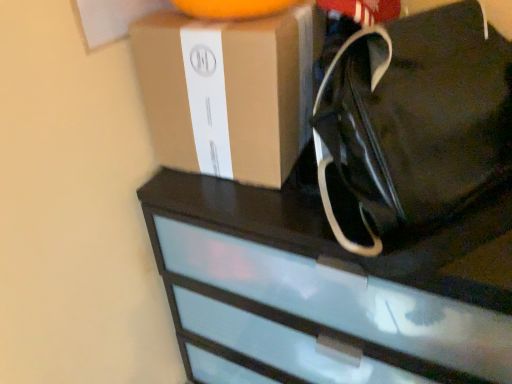
Describe the element at coordinates (229, 91) in the screenshot. I see `brown cardboard box at upper center` at that location.

Find the location of a particular element. This screenshot has height=384, width=512. brown cardboard box at upper center is located at coordinates (229, 91).

From a real-world perspective, is black glossy chest of drawers at upper center above or below brown cardboard box at upper center?

Clearly, from a real-world perspective, black glossy chest of drawers at upper center is below brown cardboard box at upper center.

Considering the positions of point (332, 333) and point (276, 29), is point (332, 333) closer or farther from the camera than point (276, 29)?

Point (332, 333) is positioned farther from the camera compared to point (276, 29).

Is black glossy chest of drawers at upper center not near brown cardboard box at upper center?

black glossy chest of drawers at upper center is actually quite close to brown cardboard box at upper center.

Who is more distant, black glossy chest of drawers at upper center or brown cardboard box at upper center?

brown cardboard box at upper center is further away from the camera.

Is black fabric tote at upper right positioned before black glossy chest of drawers at upper center?

Yes, black fabric tote at upper right is in front of black glossy chest of drawers at upper center.

From the image's perspective, is black fabric tote at upper right above black glossy chest of drawers at upper center?

Yes, from the image's perspective, black fabric tote at upper right is over black glossy chest of drawers at upper center.

Is black fabric tote at upper right positioned far away from black glossy chest of drawers at upper center?

black fabric tote at upper right is actually quite close to black glossy chest of drawers at upper center.

Identify the location of chest of drawers below the black fabric tote at upper right (from a real-world perspective). (323, 289).

Considering the relative positions of brown cardboard box at upper center and black glossy chest of drawers at upper center in the image provided, is brown cardboard box at upper center to the right of black glossy chest of drawers at upper center from the viewer's perspective?

No.

You are a GUI agent. You are given a task and a screenshot of the screen. Output one action in this format:
    pyautogui.click(x=<x>, y=<y>)
    Task: Click on the box behind the black glossy chest of drawers at upper center
    The width and height of the screenshot is (512, 384).
    Given the screenshot: What is the action you would take?
    pyautogui.click(x=229, y=91)

From a real-world perspective, between brown cardboard box at upper center and black glossy chest of drawers at upper center, who is vertically higher?

brown cardboard box at upper center, from a real-world perspective.

Can you tell me how much brown cardboard box at upper center and black glossy chest of drawers at upper center differ in facing direction?

The angle between the facing direction of brown cardboard box at upper center and the facing direction of black glossy chest of drawers at upper center is 0.442 degrees.

Is black fabric tote at upper right turned away from brown cardboard box at upper center?

Yes.

Does black fabric tote at upper right come behind brown cardboard box at upper center?

No, black fabric tote at upper right is closer to the camera.

From the image's perspective, is black fabric tote at upper right located beneath brown cardboard box at upper center?

Yes, from the image's perspective, black fabric tote at upper right is beneath brown cardboard box at upper center.

Is black fabric tote at upper right inside the boundaries of brown cardboard box at upper center, or outside?

black fabric tote at upper right is spatially situated outside brown cardboard box at upper center.

Is there a large distance between brown cardboard box at upper center and black fabric tote at upper right?

Actually, brown cardboard box at upper center and black fabric tote at upper right are a little close together.

Considering the sizes of objects brown cardboard box at upper center and black fabric tote at upper right in the image provided, who is smaller, brown cardboard box at upper center or black fabric tote at upper right?

With smaller size is brown cardboard box at upper center.

Measure the distance between brown cardboard box at upper center and black fabric tote at upper right.

The distance of brown cardboard box at upper center from black fabric tote at upper right is 7.57 inches.

Which object is positioned more to the right, brown cardboard box at upper center or black fabric tote at upper right?

From the viewer's perspective, black fabric tote at upper right appears more on the right side.

From the image's perspective, would you say black glossy chest of drawers at upper center is shown under black fabric tote at upper right?

Indeed, from the image's perspective, black glossy chest of drawers at upper center is shown beneath black fabric tote at upper right.

Locate an element on the screen. Image resolution: width=512 pixels, height=384 pixels. tote bag above the black glossy chest of drawers at upper center (from the image's perspective) is located at coordinates (415, 119).

Does black glossy chest of drawers at upper center have a larger size compared to black fabric tote at upper right?

Yes, black glossy chest of drawers at upper center is bigger than black fabric tote at upper right.

This screenshot has height=384, width=512. What are the coordinates of `chest of drawers that appears on the right of brown cardboard box at upper center` in the screenshot? It's located at coord(323,289).

Where is `the chest of drawers located behind the black fabric tote at upper right`? This screenshot has height=384, width=512. the chest of drawers located behind the black fabric tote at upper right is located at coordinates (323, 289).

Considering their positions, is black fabric tote at upper right positioned closer to black glossy chest of drawers at upper center than brown cardboard box at upper center?

The object closer to black glossy chest of drawers at upper center is black fabric tote at upper right.

When comparing their distances from black fabric tote at upper right, does black glossy chest of drawers at upper center or brown cardboard box at upper center seem further?

black glossy chest of drawers at upper center is further to black fabric tote at upper right.

Which object lies further to the anchor point black glossy chest of drawers at upper center, brown cardboard box at upper center or black fabric tote at upper right?

brown cardboard box at upper center.

Considering their positions, is black glossy chest of drawers at upper center positioned closer to brown cardboard box at upper center than black fabric tote at upper right?

black fabric tote at upper right is positioned closer to the anchor brown cardboard box at upper center.

From the image, which object appears to be farther from brown cardboard box at upper center, black fabric tote at upper right or black glossy chest of drawers at upper center?

black glossy chest of drawers at upper center is positioned further to the anchor brown cardboard box at upper center.

When comparing their distances from black fabric tote at upper right, does brown cardboard box at upper center or black glossy chest of drawers at upper center seem closer?

Based on the image, brown cardboard box at upper center appears to be nearer to black fabric tote at upper right.

You are a GUI agent. You are given a task and a screenshot of the screen. Output one action in this format:
    pyautogui.click(x=<x>, y=<y>)
    Task: Click on the tote bag that lies between brown cardboard box at upper center and black glossy chest of drawers at upper center from top to bottom
    This screenshot has width=512, height=384.
    Given the screenshot: What is the action you would take?
    pyautogui.click(x=415, y=119)